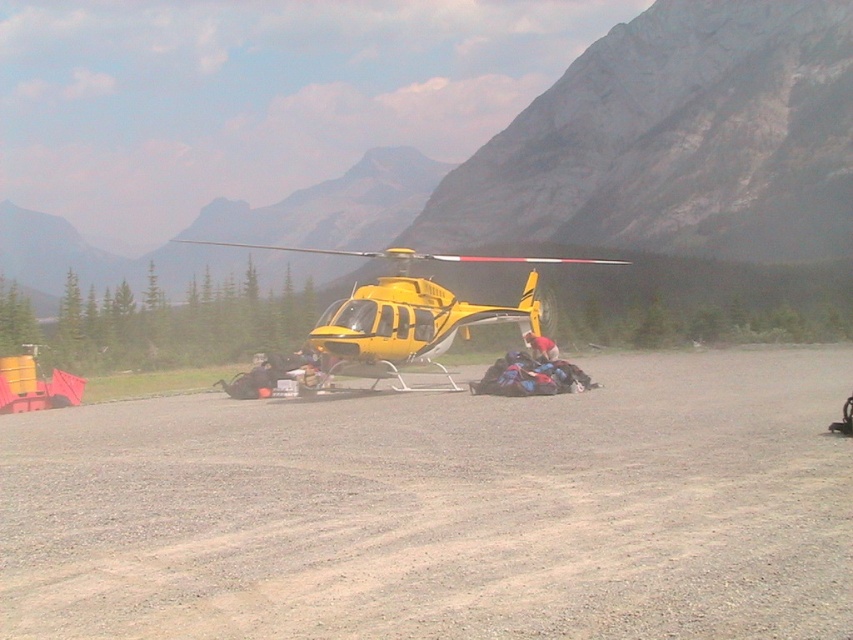
You are a pilot planning to land a helicopter that requires a landing pad at least 10 meters wide. You observe the gray gravel dirt track at center and the blue fabric bags at center. Which object can provide information about the width of the landing pad?

The gray gravel dirt track at center might be wider than blue fabric bags at center, so the gray gravel dirt track at center could indicate the width of the landing pad. However, since the exact width isn not provided, you should verify the actual dimensions before landing.

You are a pilot preparing to load supplies onto the helicopter. You have to decide whether the blue fabric bags at center can be placed along the gray gravel dirt track at center. Based on their sizes, will they fit?

The gray gravel dirt track at center is shorter than blue fabric bags at center. Therefore, the blue fabric bags at center may not fit along the gray gravel dirt track at center due to the track being shorter in length.

You are a drone operator trying to land a small drone near the yellow matte helicopter at center. According to the coordinates provided, where should you aim to place the drone so that it lands closest to the helicopter?

You should aim to place the drone at point (405,310) since that is the exact coordinate where the yellow matte helicopter at center is located, ensuring the closest possible landing spot.